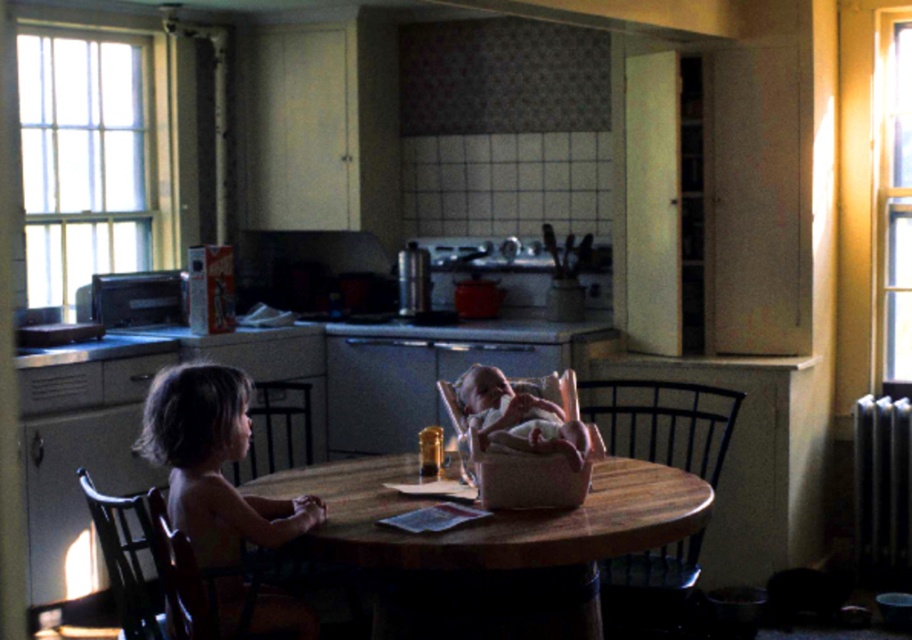
You are a parent trying to place a 1.2 meter long toy between the wooden chair at table and the soft white fabric at center. Can the toy fit between them without bending?

The wooden chair at table and the soft white fabric at center are 1.19 meters apart from each other. The toy is 1.2 meters long, so it cannot fit between them without bending.

You are a parent in the kitchen and want to place a small toy between the light brown wooden chair at left and the soft white fabric at center. Where should you place it?

The small toy should be placed between the light brown wooden chair at left and the soft white fabric at center, closer to the soft white fabric at center since the light brown wooden chair at left is positioned to the left of it.

You are a parent trying to place a new decorative pillow on the table. The soft white fabric at center is a tablecloth. Can you place the pillow on the table without moving the dark wood chair at left?

The soft white fabric at center is to the right of dark wood chair at left, so placing the pillow on the table would require moving the dark wood chair at left to access the space near the center.